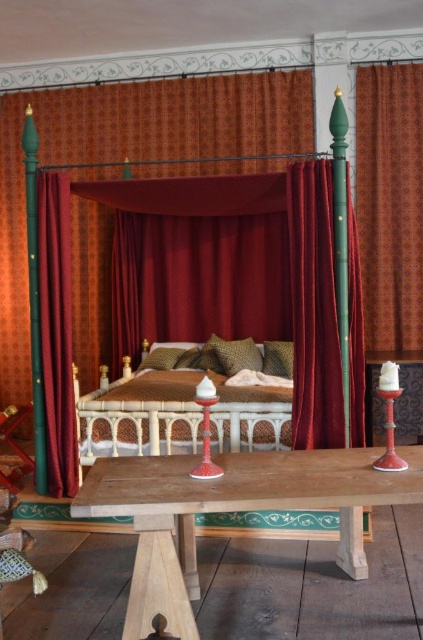
You are standing in the center of the room and want to open the patterned fabric curtain at right. Which direction should you face to reach it?

The patterned fabric curtain at right is located at point 0.319 on the x and 0.922 on the y, so you should face towards the right side of the room to reach it.

You are standing in the room and want to adjust the curtains. Which curtain is higher up, the patterned fabric curtain at right or the velvet curtain at right?

The patterned fabric curtain at right is above the velvet curtain at right, so it is higher up.

You are standing in the room and want to determine the relative positions of two points marked in the scene. Which point is closer to you, point [395,122] or point [268,369]?

Point [395,122] is further to the viewer than point [268,369], so point [268,369] is closer to you.